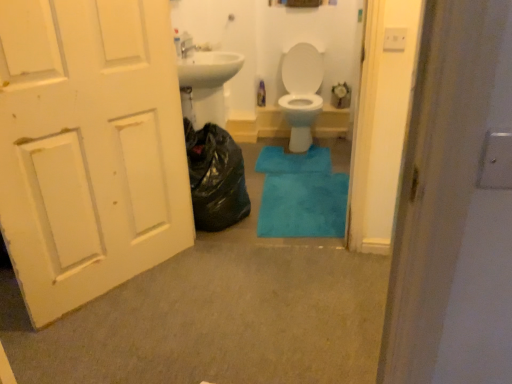
Question: Choose the correct answer: Is blue plush bath mat at center, which is counted as the 2th bath mat, starting from the top, inside white painted wood door at left or outside it?

Choices:
 (A) inside
 (B) outside

Answer: (B)

Question: Is blue plush bath mat at center, which is counted as the 2th bath mat, starting from the top, wider or thinner than white painted wood door at left?

Choices:
 (A) thin
 (B) wide

Answer: (B)

Question: Estimate the real-world distances between objects in this image. Which object is closer to the white glossy toilet at center?

Choices:
 (A) blue plush bath mat at center, arranged as the 1th bath mat when viewed from the front
 (B) black plastic bag at left
 (C) blue plush bath mat at center, the second bath mat positioned from the bottom
 (D) white painted wood door at left

Answer: (C)

Question: Based on their relative distances, which object is farther from the blue plush bath mat at center, which is counted as the 2th bath mat, starting from the top?

Choices:
 (A) white painted wood door at left
 (B) black plastic bag at left
 (C) blue plush bath mat at center, which ranks as the first bath mat in top-to-bottom order
 (D) white glossy toilet at center

Answer: (A)